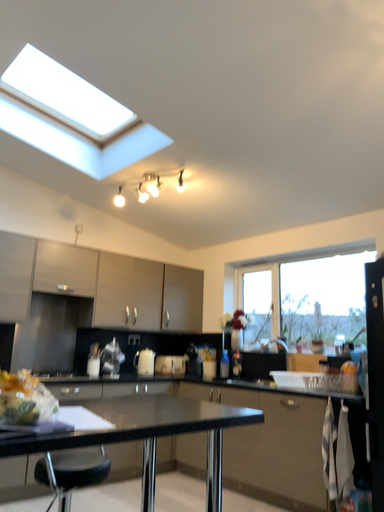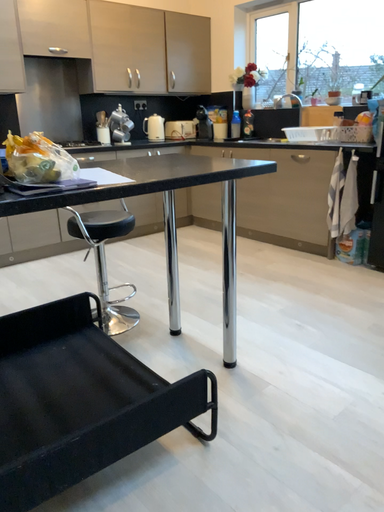
Question: Which way did the camera rotate in the video?

Choices:
 (A) rotated upward
 (B) rotated downward

Answer: (B)